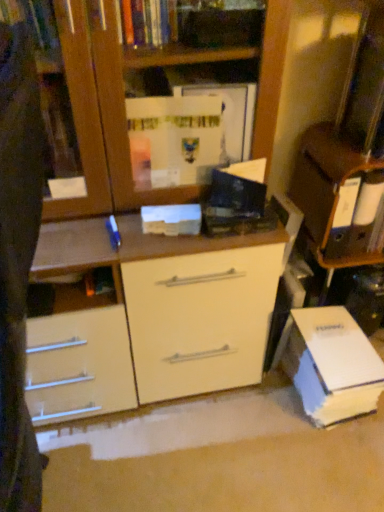
Question: Is white cardboard book at lower right, which is the 1th paperback book from back to front, outside of white glossy cabinet at upper right?

Choices:
 (A) no
 (B) yes

Answer: (B)

Question: Considering the relative sizes of white cardboard book at lower right, which ranks as the first paperback book in bottom-to-top order, and white glossy cabinet at upper right in the image provided, is white cardboard book at lower right, which ranks as the first paperback book in bottom-to-top order, bigger than white glossy cabinet at upper right?

Choices:
 (A) yes
 (B) no

Answer: (A)

Question: Can you confirm if white cardboard book at lower right, which ranks as the 2th paperback book in left-to-right order, is wider than white glossy cabinet at upper right?

Choices:
 (A) no
 (B) yes

Answer: (B)

Question: Is white cardboard book at lower right, which is the 1th paperback book from back to front, next to white glossy cabinet at upper right?

Choices:
 (A) yes
 (B) no

Answer: (B)

Question: From a real-world perspective, is white cardboard book at lower right, which ranks as the 2th paperback book in left-to-right order, over white glossy cabinet at upper right?

Choices:
 (A) yes
 (B) no

Answer: (B)

Question: Is white cardboard book at lower right, which ranks as the 2th paperback book in left-to-right order, facing away from white glossy cabinet at upper right?

Choices:
 (A) no
 (B) yes

Answer: (A)

Question: From a real-world perspective, is white matte paperback book at center, the second paperback book in the right-to-left sequence, physically above white cardboard book at lower right, arranged as the 2th paperback book when viewed from the front?

Choices:
 (A) yes
 (B) no

Answer: (A)

Question: Does white matte paperback book at center, positioned as the 2th paperback book in bottom-to-top order, have a lesser height compared to white cardboard book at lower right, which is the 1th paperback book from back to front?

Choices:
 (A) no
 (B) yes

Answer: (B)

Question: Could you tell me if white matte paperback book at center, the second paperback book in the right-to-left sequence, is turned towards white cardboard book at lower right, which ranks as the 2th paperback book in top-to-bottom order?

Choices:
 (A) yes
 (B) no

Answer: (B)

Question: Could white cardboard book at lower right, arranged as the 2th paperback book when viewed from the front, be considered to be inside white matte paperback book at center, arranged as the first paperback book when viewed from the front?

Choices:
 (A) no
 (B) yes

Answer: (A)

Question: Is white matte paperback book at center, which is the first paperback book from top to bottom, closer to the viewer compared to white cardboard book at lower right, which ranks as the 2th paperback book in left-to-right order?

Choices:
 (A) yes
 (B) no

Answer: (A)

Question: Considering the relative sizes of white matte paperback book at center, placed as the first paperback book when sorted from left to right, and white cardboard book at lower right, which is counted as the first paperback book, starting from the right, in the image provided, is white matte paperback book at center, placed as the first paperback book when sorted from left to right, smaller than white cardboard book at lower right, which is counted as the first paperback book, starting from the right,?

Choices:
 (A) yes
 (B) no

Answer: (A)

Question: Is white matte paperback book at center, which is the first paperback book from top to bottom, oriented away from white glossy cabinet at upper right?

Choices:
 (A) yes
 (B) no

Answer: (B)